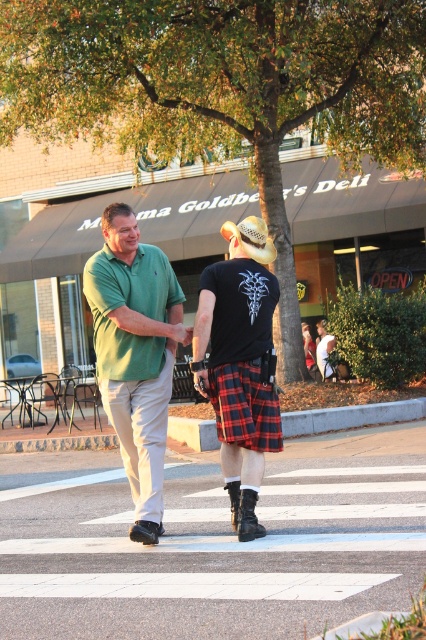
You are standing on the sidewalk across from Mama Goldberg Deli and see two people crossing the street. One is wearing a green cotton polo shirt at center and the other has a tan straw cowboy hat at center. Which of these two is closer to you?

The green cotton polo shirt at center is closer to you because it is in front of the tan straw cowboy hat at center.